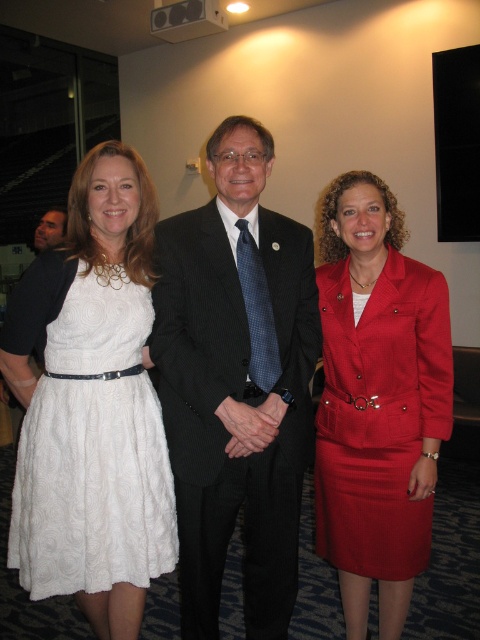
Question: Can you confirm if matte red skirt suit at center is positioned to the left of white textured dress at left?

Choices:
 (A) no
 (B) yes

Answer: (A)

Question: Which object appears closest to the camera in this image?

Choices:
 (A) white textured dress at left
 (B) black pinstripe suit at center

Answer: (A)

Question: Does black pinstripe suit at center lie behind white textured dress at left?

Choices:
 (A) no
 (B) yes

Answer: (B)

Question: Which is farther from the matte red skirt suit at center?

Choices:
 (A) black pinstripe suit at center
 (B) white textured dress at left

Answer: (B)

Question: Which point is closer to the camera?

Choices:
 (A) (267, 131)
 (B) (359, 524)

Answer: (B)

Question: Observing the image, what is the correct spatial positioning of matte red skirt suit at center in reference to white textured dress at left?

Choices:
 (A) left
 (B) right

Answer: (B)